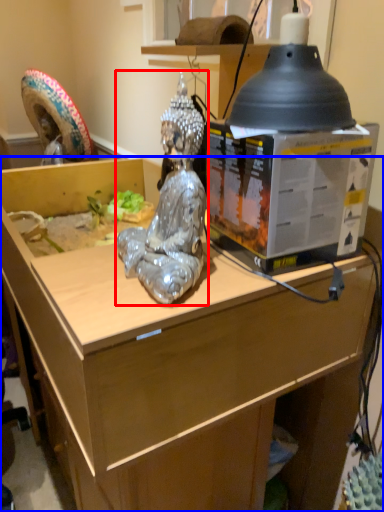
Question: Which of the following is the farthest to the observer, person (highlighted by a red box) or desk (highlighted by a blue box)?

Choices:
 (A) person
 (B) desk

Answer: (B)